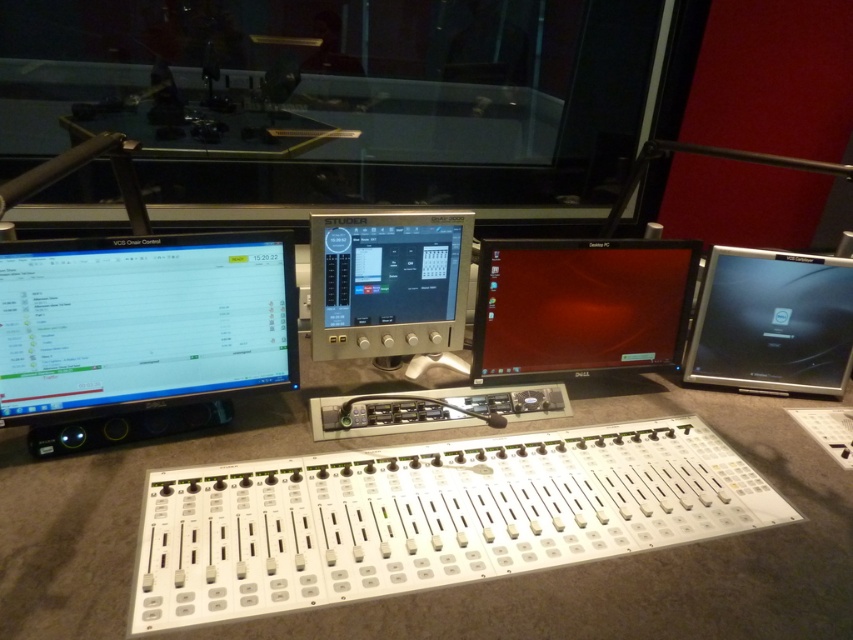
Is matte black monitor at left below matte silver laptop at right?

No.

Can you confirm if matte black monitor at left is positioned above matte silver laptop at right?

Yes, matte black monitor at left is above matte silver laptop at right.

Find the location of `matte black monitor at left`. matte black monitor at left is located at coordinates (142, 321).

Is the position of matte black monitor at left less distant than that of matte black monitor at center?

Yes, it is.

Find the location of a particular element. The height and width of the screenshot is (640, 853). matte black monitor at left is located at coordinates (142, 321).

Where is `matte black monitor at left`? This screenshot has height=640, width=853. matte black monitor at left is located at coordinates (142, 321).

Who is taller, matte black monitor at left or silver metallic monitor at center?

silver metallic monitor at center

Who is more distant from viewer, (102, 340) or (369, 250)?

The point (369, 250) is more distant.

Does point (122, 353) come behind point (467, 241)?

That is False.

The width and height of the screenshot is (853, 640). I want to click on matte black monitor at left, so click(x=142, y=321).